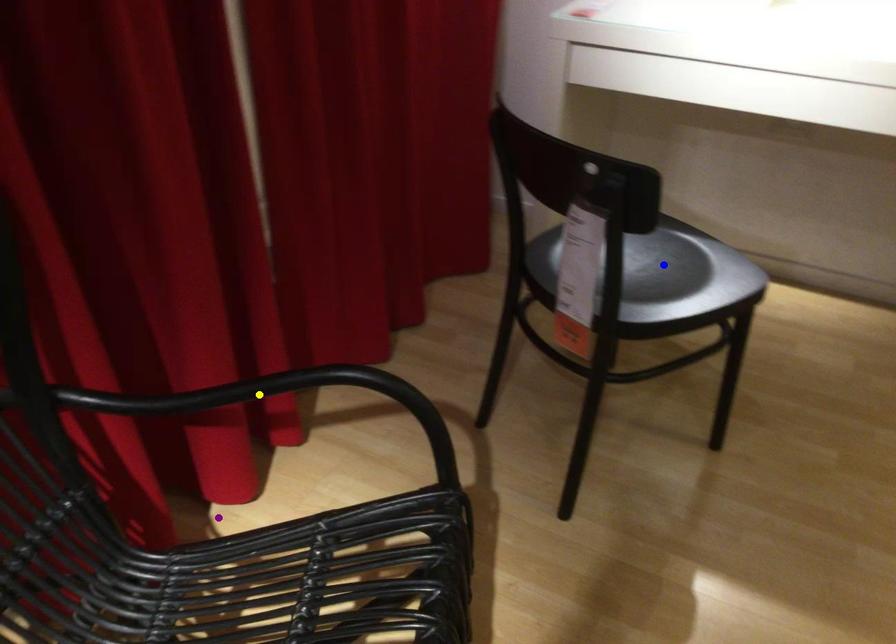
Order these from nearest to farthest:
yellow point | blue point | purple point

yellow point → blue point → purple point